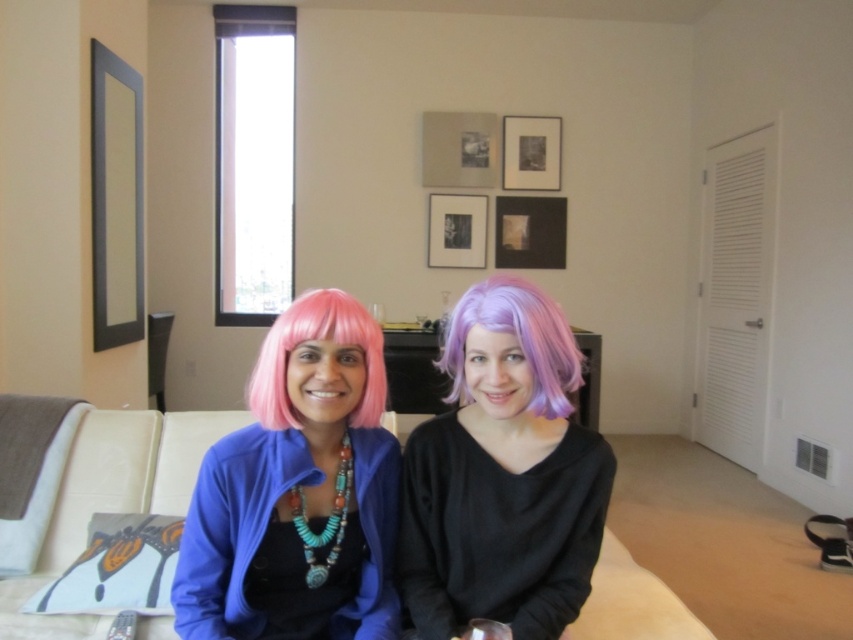
Question: Is purple silky wig at center to the right of pink synthetic wig at center from the viewer's perspective?

Choices:
 (A) yes
 (B) no

Answer: (A)

Question: Which point is farther to the camera?

Choices:
 (A) (274, 403)
 (B) (486, 288)
 (C) (643, 621)

Answer: (C)

Question: Does beige fabric couch at center appear under purple silky wig at center?

Choices:
 (A) yes
 (B) no

Answer: (A)

Question: Is the position of purple matte wig at center less distant than that of beige fabric couch at center?

Choices:
 (A) no
 (B) yes

Answer: (B)

Question: Among these objects, which one is farthest from the camera?

Choices:
 (A) purple matte wig at center
 (B) beige fabric couch at center

Answer: (B)

Question: Estimate the real-world distances between objects in this image. Which object is farther from the beige fabric couch at center?

Choices:
 (A) purple matte wig at center
 (B) pink synthetic wig at center

Answer: (A)